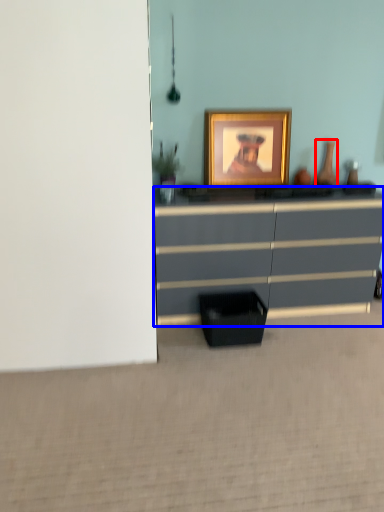
Question: Which object appears farthest to the camera in this image, vase (highlighted by a red box) or chest of drawers (highlighted by a blue box)?

Choices:
 (A) vase
 (B) chest of drawers

Answer: (A)